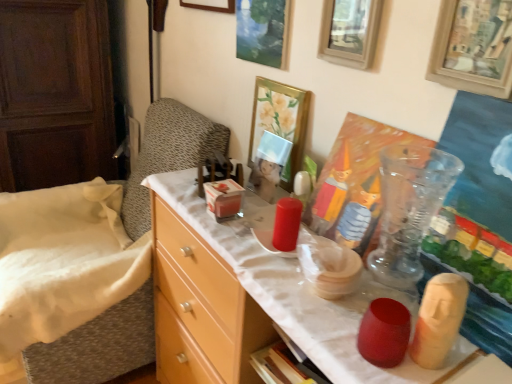
The width and height of the screenshot is (512, 384). I want to click on free space that is to the left of matte red glass at lower right, so click(x=317, y=322).